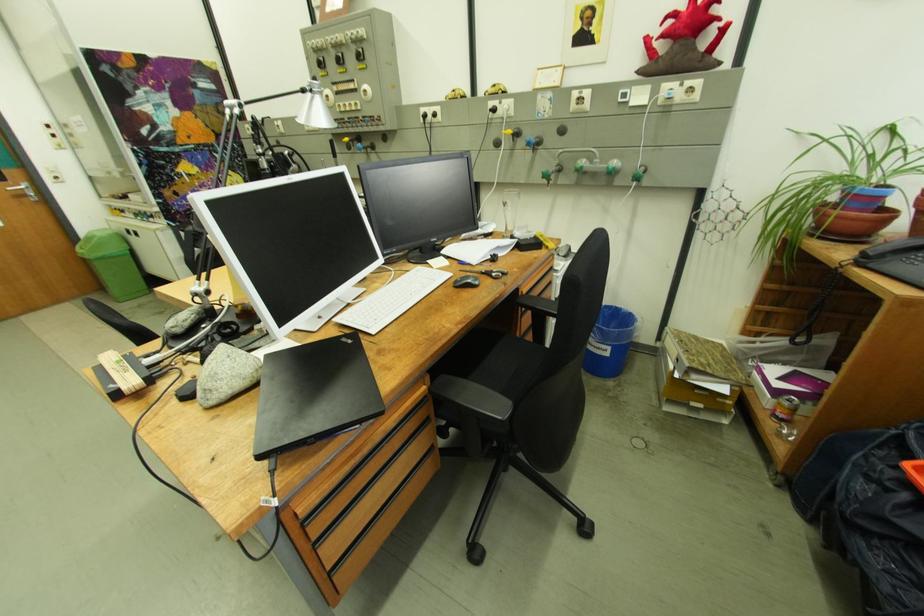
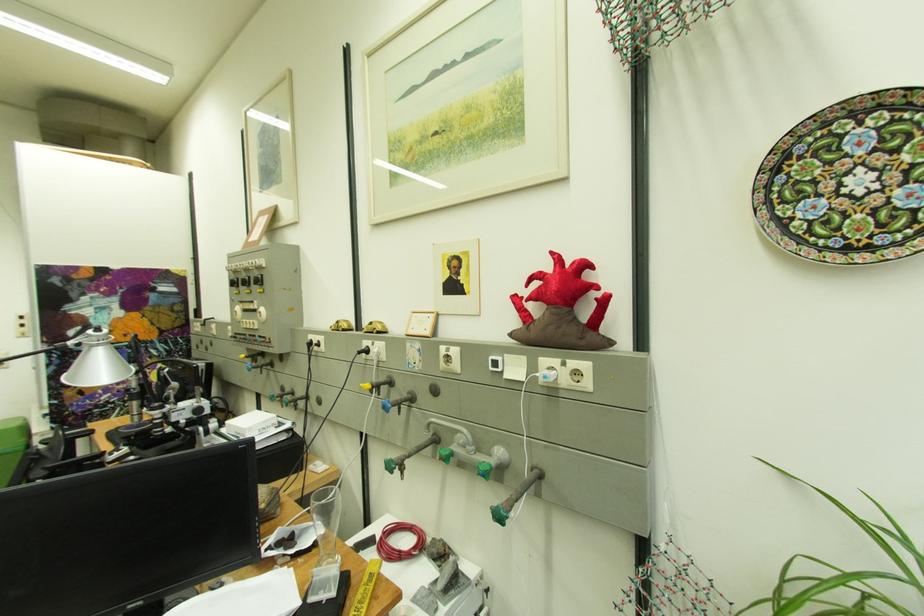
Where in the second image is the point corresponding to (504,86) from the first image?

(382, 323)